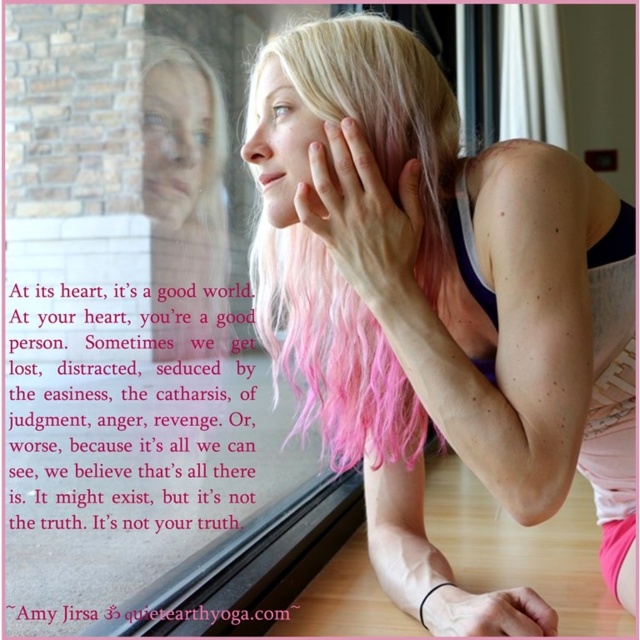
What are the coordinates of the pink hair at upper center?

The pink hair at upper center is located at point [429,289].

You are an interior designer working on a project and need to place a small decorative item exactly where the pink hair at upper center is located. According to the coordinates provided, what are the exact coordinates where you should place the item?

The exact coordinates for placing the decorative item are at point (429, 289) where the pink hair at upper center is located.

You are a photographer trying to capture a closeup of the pink hair at upper center. Your camera has a minimum focusing distance of 30 inches. Can you take the photo without moving the camera or the subject?

The pink hair at upper center and camera are 29.86 inches apart from each other, which is less than the camera minimum focusing distance of 30 inches. Therefore, you cannot take the photo without moving the camera or the subject.